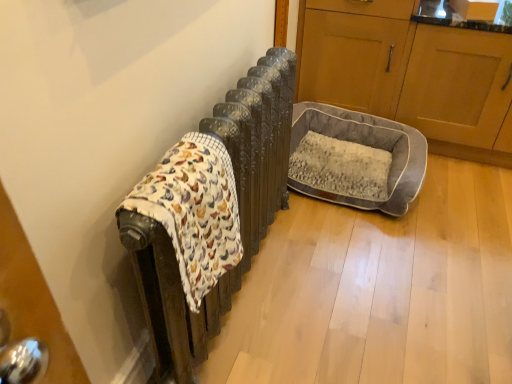
What are the coordinates of `free space above fluffy cotton blanket at left (from a real-world perspective)` in the screenshot? It's located at (178, 165).